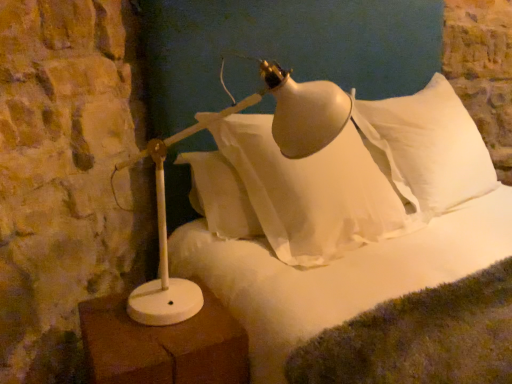
Question: Can you confirm if white matte lamp at left is wider than white soft pillow at upper right?

Choices:
 (A) yes
 (B) no

Answer: (A)

Question: From the image's perspective, is white matte lamp at left located beneath white soft pillow at upper right?

Choices:
 (A) no
 (B) yes

Answer: (B)

Question: Is white matte lamp at left oriented away from white soft pillow at upper right?

Choices:
 (A) yes
 (B) no

Answer: (B)

Question: Does white matte lamp at left have a lesser height compared to white soft pillow at upper right?

Choices:
 (A) yes
 (B) no

Answer: (A)

Question: Considering the relative sizes of white matte lamp at left and white soft pillow at upper right in the image provided, is white matte lamp at left smaller than white soft pillow at upper right?

Choices:
 (A) yes
 (B) no

Answer: (A)

Question: Is white matte lamp at left taller or shorter than white fluffy bed at center?

Choices:
 (A) short
 (B) tall

Answer: (A)

Question: Is white matte lamp at left wider or thinner than white fluffy bed at center?

Choices:
 (A) wide
 (B) thin

Answer: (B)

Question: Looking at the image, does white matte lamp at left seem bigger or smaller compared to white fluffy bed at center?

Choices:
 (A) small
 (B) big

Answer: (A)

Question: From a real-world perspective, is white matte lamp at left positioned above or below white fluffy bed at center?

Choices:
 (A) above
 (B) below

Answer: (A)

Question: Considering the positions of white matte lamp at left and white matte table lamp at lower left in the image, is white matte lamp at left taller or shorter than white matte table lamp at lower left?

Choices:
 (A) tall
 (B) short

Answer: (A)

Question: Considering the positions of white matte lamp at left and white matte table lamp at lower left in the image, is white matte lamp at left wider or thinner than white matte table lamp at lower left?

Choices:
 (A) wide
 (B) thin

Answer: (A)

Question: From the image's perspective, is white matte lamp at left positioned above or below white matte table lamp at lower left?

Choices:
 (A) above
 (B) below

Answer: (A)

Question: Does point (324, 81) appear closer or farther from the camera than point (233, 350)?

Choices:
 (A) closer
 (B) farther

Answer: (B)

Question: In terms of height, does white soft pillow at upper right look taller or shorter compared to white fluffy bed at center?

Choices:
 (A) tall
 (B) short

Answer: (B)

Question: In terms of size, does white soft pillow at upper right appear bigger or smaller than white fluffy bed at center?

Choices:
 (A) big
 (B) small

Answer: (B)